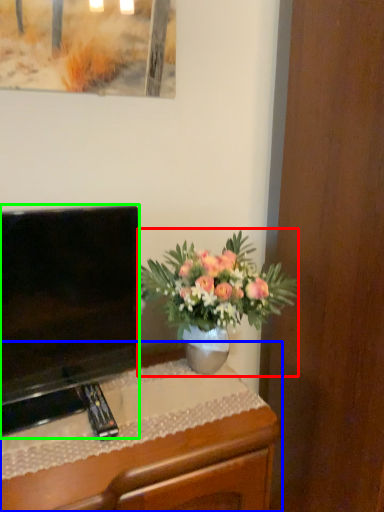
Question: Which object is the closest to the houseplant (highlighted by a red box)? Choose among these: desk (highlighted by a blue box) or television (highlighted by a green box).

Choices:
 (A) desk
 (B) television

Answer: (B)